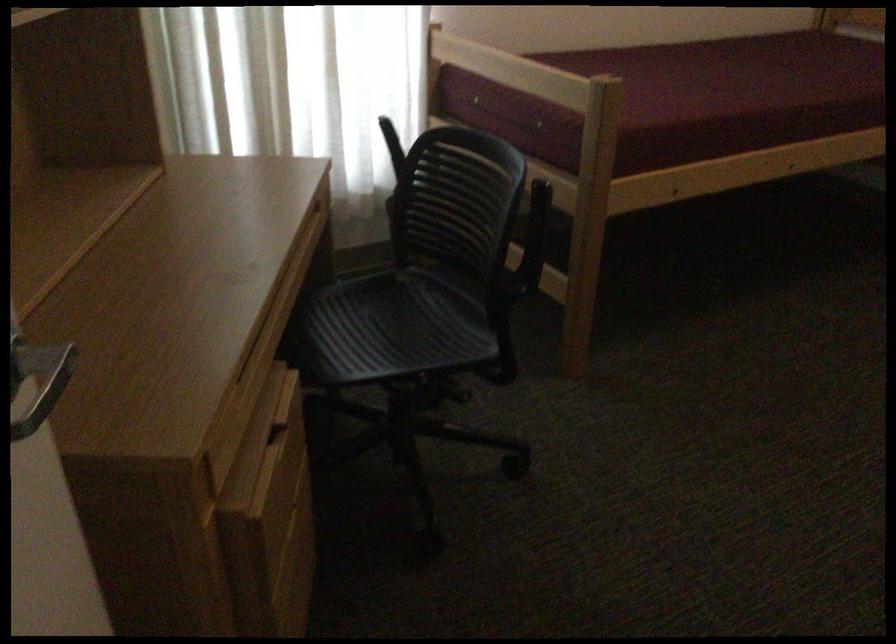
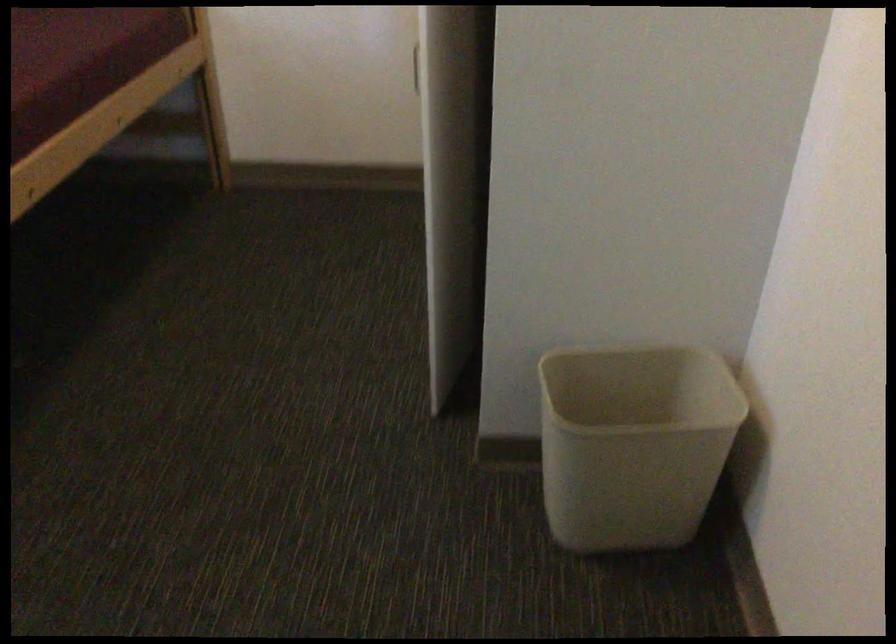
Question: The first image is from the beginning of the video and the second image is from the end. How did the camera likely rotate when shooting the video?

Choices:
 (A) Left
 (B) Right
 (C) Up
 (D) Down

Answer: (B)